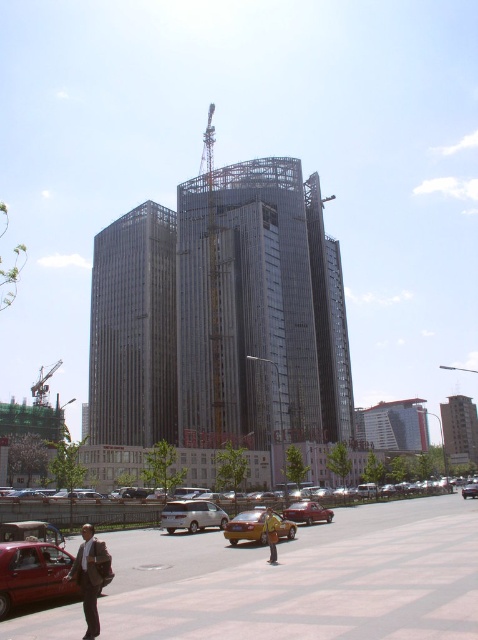
Question: Does metallic taxi at lower left come in front of yellow matte taxi at center?

Choices:
 (A) yes
 (B) no

Answer: (A)

Question: Which of these objects is positioned closest to the yellow matte taxi at center?

Choices:
 (A) metallic gray crane at left
 (B) metallic yellow taxi at center

Answer: (B)

Question: Does sleek metallic building at center come behind metallic taxi at lower left?

Choices:
 (A) yes
 (B) no

Answer: (A)

Question: Among these objects, which one is farthest from the camera?

Choices:
 (A) yellow matte taxi at center
 (B) yellow metallic taxi at lower left
 (C) metallic gray crane at left

Answer: (C)

Question: Among these objects, which one is farthest from the camera?

Choices:
 (A) metallic gray crane at left
 (B) dark brown leather jacket at lower left
 (C) metallic taxi at lower left

Answer: (A)

Question: Is glassy concrete building at center to the left of yellow fabric bag at center from the viewer's perspective?

Choices:
 (A) yes
 (B) no

Answer: (B)